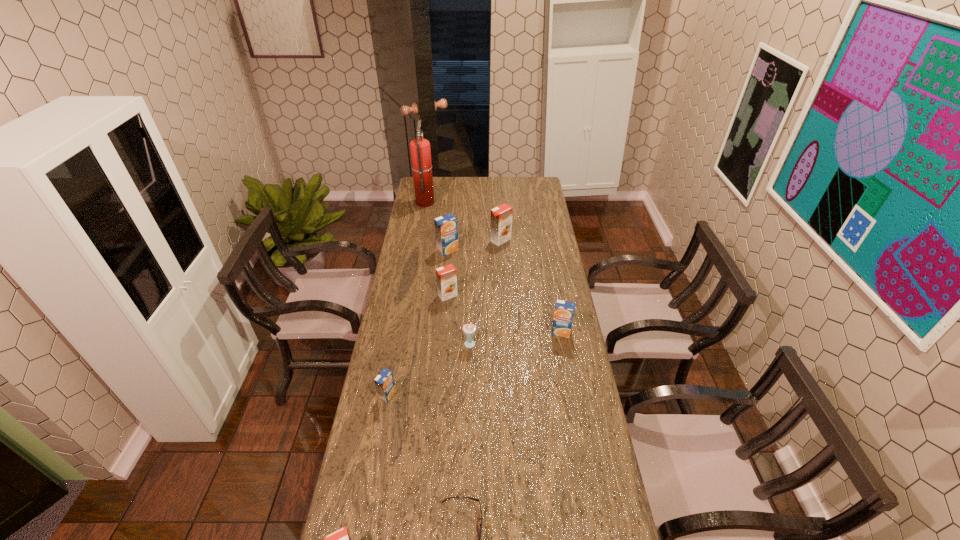
The height and width of the screenshot is (540, 960). In order to click on white milkshake in this screenshot , I will do `click(469, 329)`.

Where is `the fourth nearest object`? This screenshot has height=540, width=960. the fourth nearest object is located at coordinates (469, 329).

You are a GUI agent. You are given a task and a screenshot of the screen. Output one action in this format:
    pyautogui.click(x=<x>, y=<y>)
    Task: Click on the leftmost blue orange_juice
    This screenshot has height=540, width=960.
    Given the screenshot: What is the action you would take?
    pyautogui.click(x=384, y=382)

Locate an element on the screen. The image size is (960, 540). the third nearest object is located at coordinates (384, 382).

Where is `free region located 0.080m with the nozzle and gauge on the fire extinguisher`? Image resolution: width=960 pixels, height=540 pixels. free region located 0.080m with the nozzle and gauge on the fire extinguisher is located at coordinates (449, 202).

I want to click on free space located 0.160m on the back of the second object from right to left, so click(x=499, y=217).

I want to click on vacant area located on the front of the farthest blue orange_juice, so click(446, 269).

Where is `vacant space located on the front of the fourth farthest object`? Image resolution: width=960 pixels, height=540 pixels. vacant space located on the front of the fourth farthest object is located at coordinates (442, 368).

Locate an element on the screen. Image resolution: width=960 pixels, height=540 pixels. vacant point located on the left of the fifth nearest object is located at coordinates (496, 332).

Find the location of a particular element. free space located on the straw side of the milkshake is located at coordinates point(471,397).